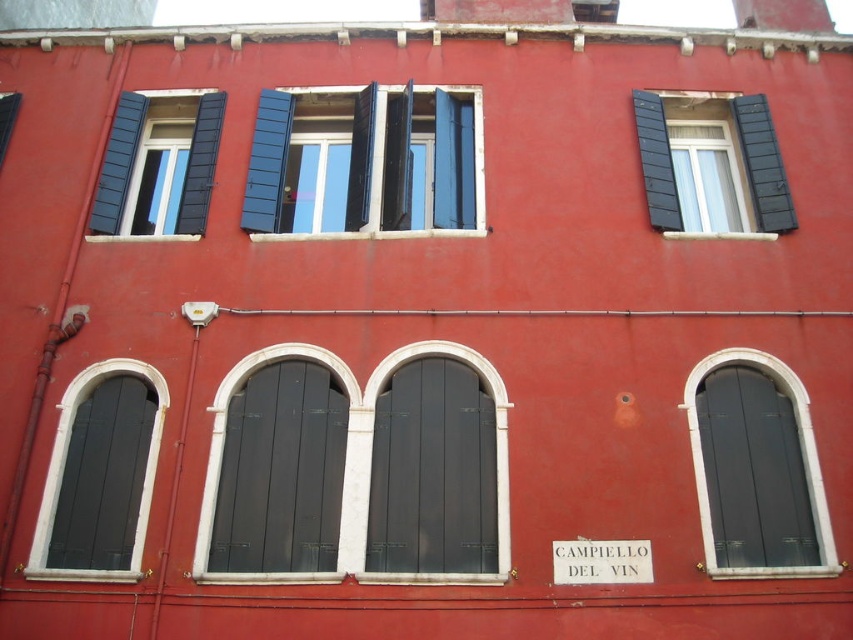
Is black matte wood window at center to the left of matte black window at center from the viewer's perspective?

Indeed, black matte wood window at center is positioned on the left side of matte black window at center.

Is black matte wood window at center positioned before matte black window at center?

Yes, black matte wood window at center is closer to the viewer.

I want to click on black matte wood window at center, so click(276, 465).

Identify the location of matte black door at center. (437, 467).

Is matte black door at center shorter than matte black window at lower right?

In fact, matte black door at center may be taller than matte black window at lower right.

Where is `matte black door at center`? This screenshot has height=640, width=853. matte black door at center is located at coordinates (437, 467).

Can you confirm if matte black window at lower right is smaller than black matte window at left?

No.

Which is more to the left, matte black window at lower right or black matte window at left?

Positioned to the left is black matte window at left.

Who is more forward, (770, 563) or (141, 531)?

Point (770, 563)

Identify the location of matte black window at lower right. The height and width of the screenshot is (640, 853). (756, 468).